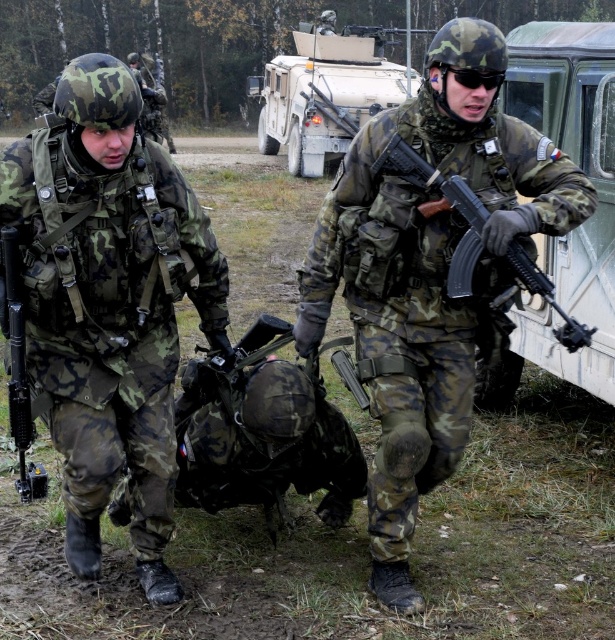
Question: Is green matte truck at right wider than matte black rifle at left?

Choices:
 (A) yes
 (B) no

Answer: (A)

Question: Does green matte truck at right have a lesser width compared to matte black rifle at left?

Choices:
 (A) yes
 (B) no

Answer: (B)

Question: Based on their relative distances, which object is nearer to the camouflage fabric uniform at center?

Choices:
 (A) matte black rifle at left
 (B) camouflage uniform at center
 (C) camouflage-patterned military vehicle at center
 (D) matte black rifle at center

Answer: (A)

Question: Is camouflage-patterned military vehicle at center above matte black rifle at center?

Choices:
 (A) no
 (B) yes

Answer: (B)

Question: Which of the following is the closest to the observer?

Choices:
 (A) camouflage-patterned military vehicle at center
 (B) green matte truck at right
 (C) camouflage fabric uniform at center

Answer: (C)

Question: Which object is positioned closest to the matte black rifle at center?

Choices:
 (A) camouflage-patterned military vehicle at center
 (B) green matte truck at right

Answer: (B)